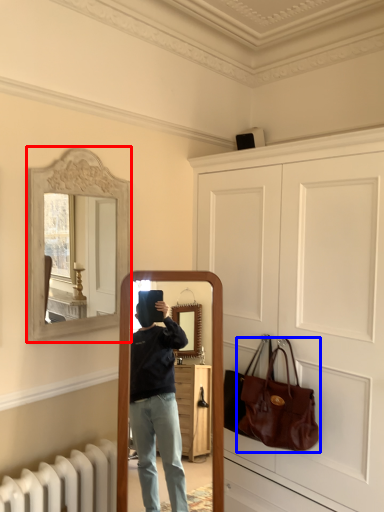
Question: Among these objects, which one is farthest to the camera, picture frame (highlighted by a red box) or handbag (highlighted by a blue box)?

Choices:
 (A) picture frame
 (B) handbag

Answer: (B)